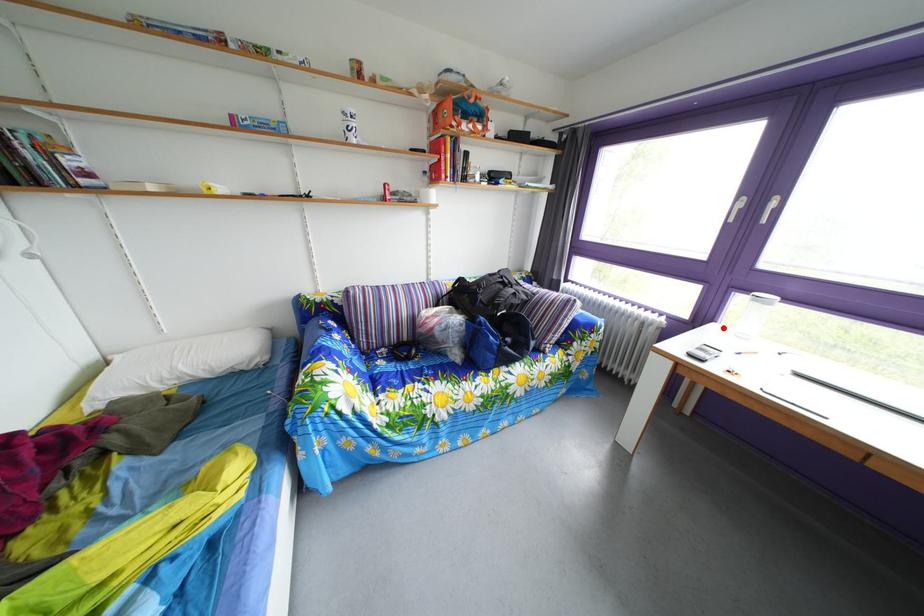
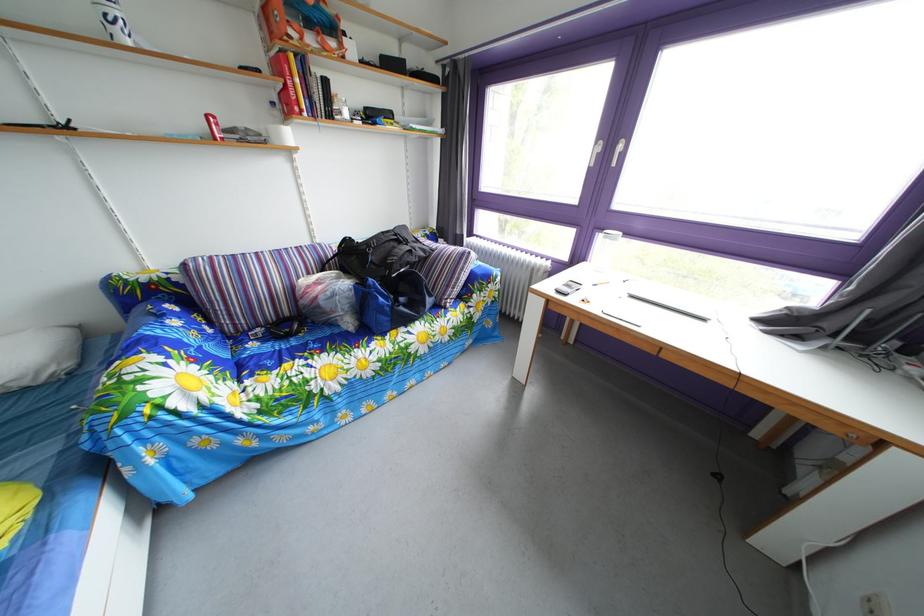
Locate, in the second image, the point that corresponds to the highlighted location in the first image.

(594, 268)